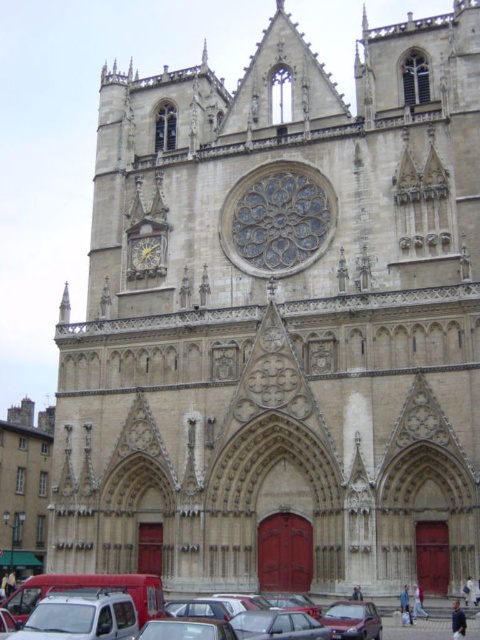
Question: Does metallic silver car at center have a lesser width compared to matte black car at center?

Choices:
 (A) no
 (B) yes

Answer: (A)

Question: Observing the image, what is the correct spatial positioning of metallic silver car at center in reference to matte black car at center?

Choices:
 (A) right
 (B) left

Answer: (B)

Question: Is the position of metallic silver car at center less distant than that of gold metallic clock at center-left?

Choices:
 (A) yes
 (B) no

Answer: (A)

Question: Which point appears closest to the camera in this image?

Choices:
 (A) (292, 604)
 (B) (336, 620)
 (C) (162, 237)

Answer: (B)

Question: Which point is farther from the camera taking this photo?

Choices:
 (A) (91, 579)
 (B) (157, 260)

Answer: (B)

Question: Which of the following is the closest to the observer?

Choices:
 (A) (137, 268)
 (B) (51, 588)
 (C) (358, 627)

Answer: (C)